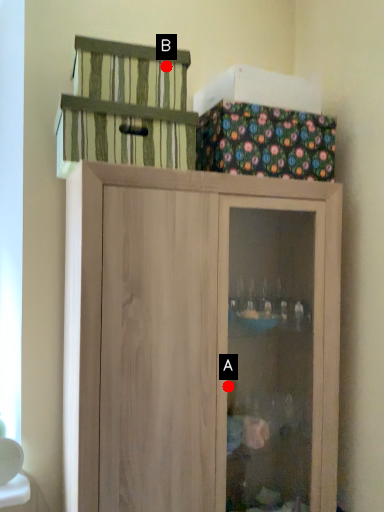
Question: Two points are circled on the image, labeled by A and B beside each circle. Among these points, which one is farthest from the camera?

Choices:
 (A) A is further
 (B) B is further

Answer: (A)